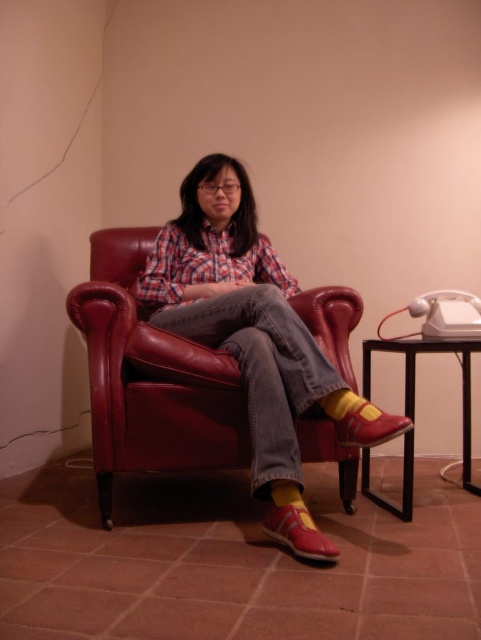
Question: Is black metal side table at lower right closer to camera compared to shiny red leather shoe at lower right?

Choices:
 (A) no
 (B) yes

Answer: (A)

Question: Which object is closer to the camera taking this photo?

Choices:
 (A) black metal side table at lower right
 (B) matte leather chair at center
 (C) matte red shoe at lower center
 (D) shiny red leather shoe at lower right

Answer: (C)

Question: Among these objects, which one is farthest from the camera?

Choices:
 (A) matte red shoe at lower center
 (B) shiny red leather shoe at lower right
 (C) black metal side table at lower right

Answer: (C)

Question: Is black metal side table at lower right bigger than matte red shoe at lower center?

Choices:
 (A) no
 (B) yes

Answer: (B)

Question: Which point is closer to the camera?

Choices:
 (A) (405, 474)
 (B) (276, 522)
 (C) (327, 364)
 (D) (342, 442)

Answer: (B)

Question: Is black metal side table at lower right wider than shiny red leather shoe at lower right?

Choices:
 (A) no
 (B) yes

Answer: (B)